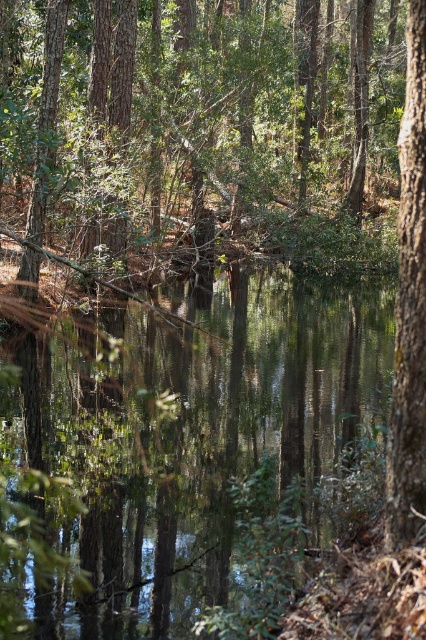
You are a photographer standing at the edge of a forest with a camera. You want to take a photo of the brown rough tree at center. If you are currently 15.69 feet away from the tree, is this distance suitable for capturing the entire tree in your shot?

The distance between you and the brown rough tree at center is 15.69 feet. This distance may be suitable for capturing the entire tree in your shot, depending on your camera lens. A standard lens might require being closer, while a wide angle lens could capture the entire tree from this distance.